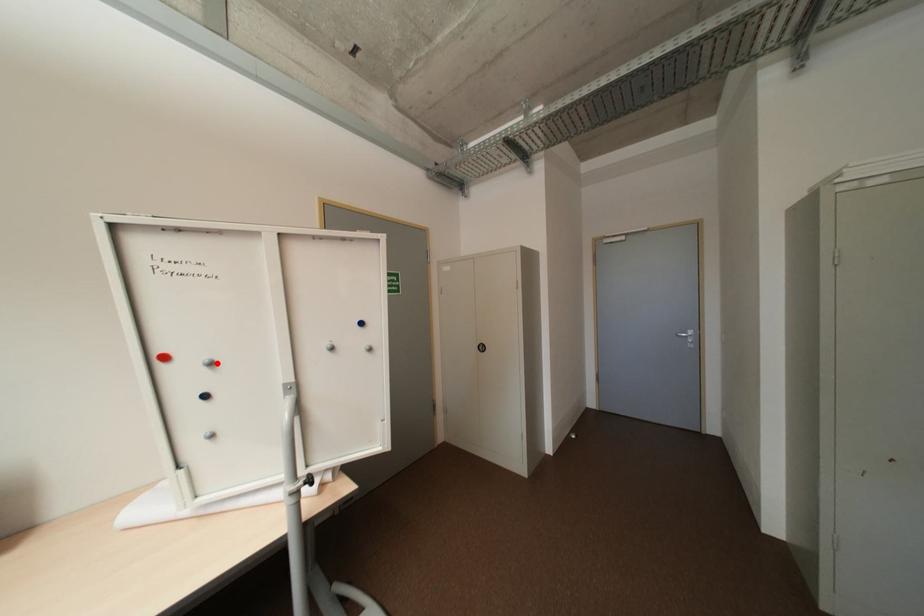
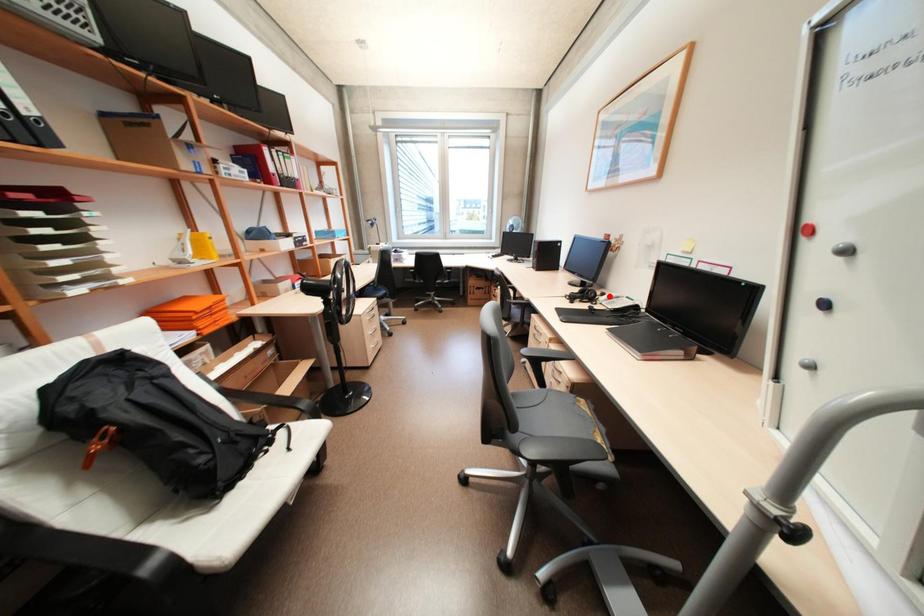
I am providing you with two images of the same scene from different viewpoints. A red point is marked on the first image and another point is marked on the second image. Does the point marked in image1 correspond to the same location as the one in image2?

No